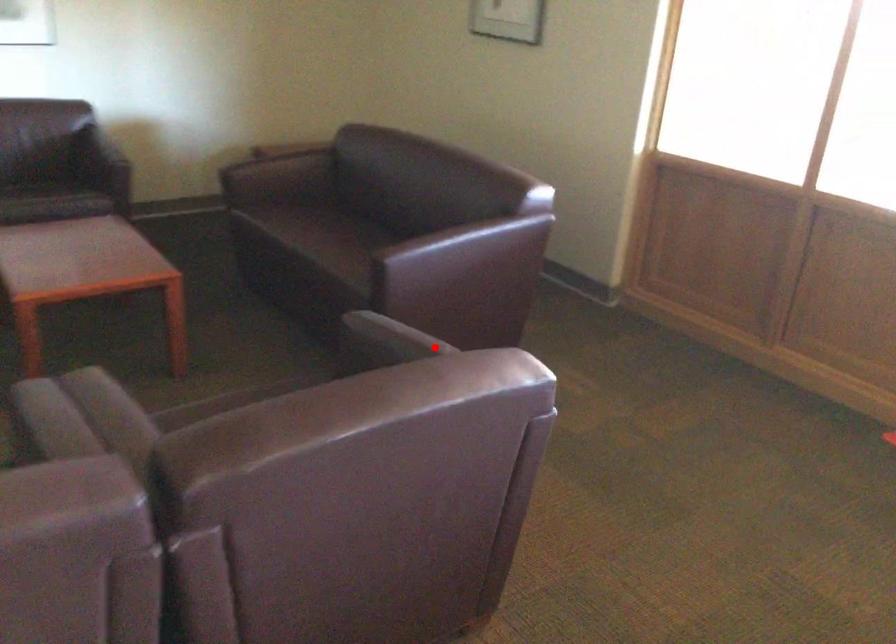
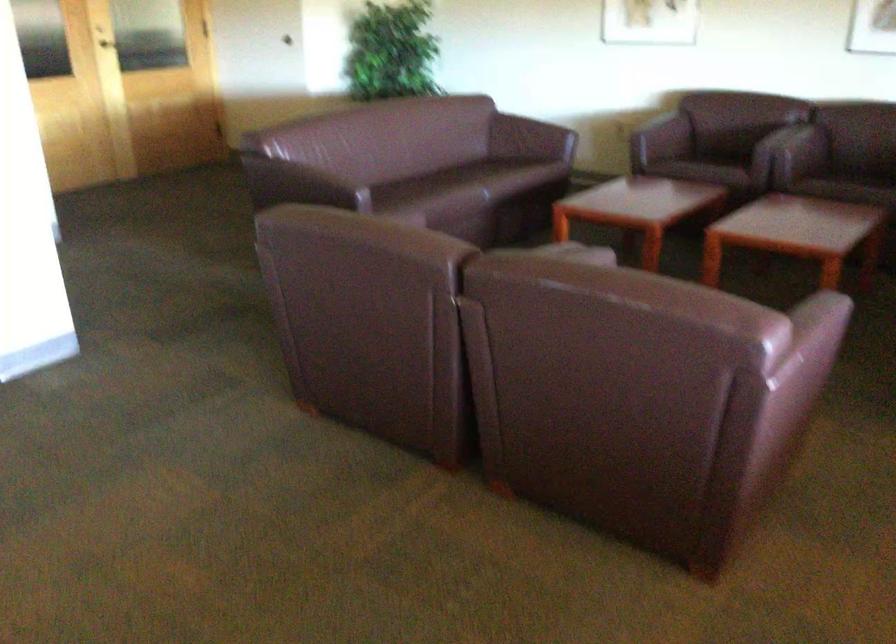
Find the pixel in the second image that matches the highlighted location in the first image.

(821, 325)